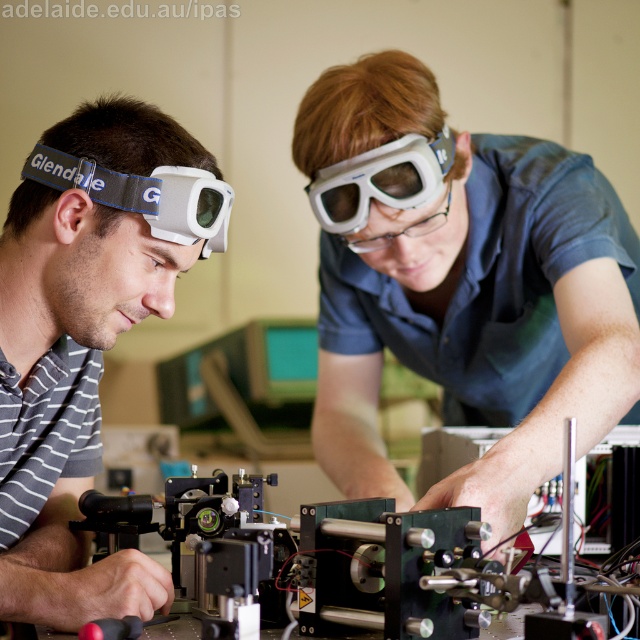
In the scene shown: Is metallic black mechanical device at center smaller than white matte/glossy goggles at left?

Actually, metallic black mechanical device at center might be larger than white matte/glossy goggles at left.

Is point (445, 586) positioned in front of point (138, 204)?

Yes, it is in front of point (138, 204).

Where is `metallic black mechanical device at center`? This screenshot has width=640, height=640. metallic black mechanical device at center is located at coordinates click(362, 577).

Which is more to the left, white matte goggles at left or white matte/glossy goggles at left?

white matte goggles at left

Which is in front, point (138, 100) or point (188, 216)?

Positioned in front is point (188, 216).

Which is in front, point (76, 621) or point (33, 150)?

Point (76, 621)

Where is `white matte goggles at left`? This screenshot has height=640, width=640. white matte goggles at left is located at coordinates (72, 388).

Can you confirm if white matte goggles at left is wider than metallic black mechanical device at center?

In fact, white matte goggles at left might be narrower than metallic black mechanical device at center.

Who is more forward, (67, 461) or (356, 609)?

Point (356, 609) is in front.

Is point (129, 326) behind point (339, 577)?

Yes.

Identify the location of white matte goggles at left. This screenshot has width=640, height=640. (72, 388).